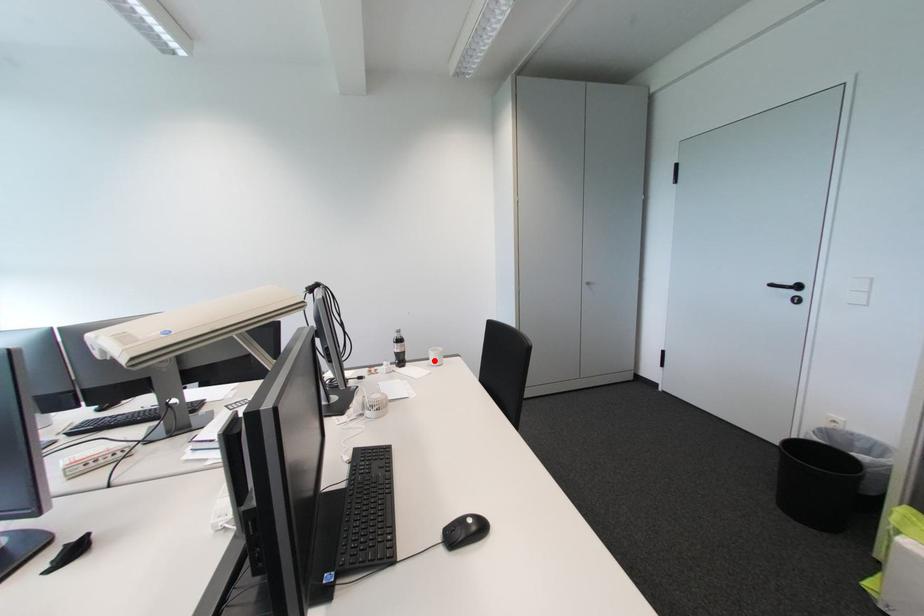
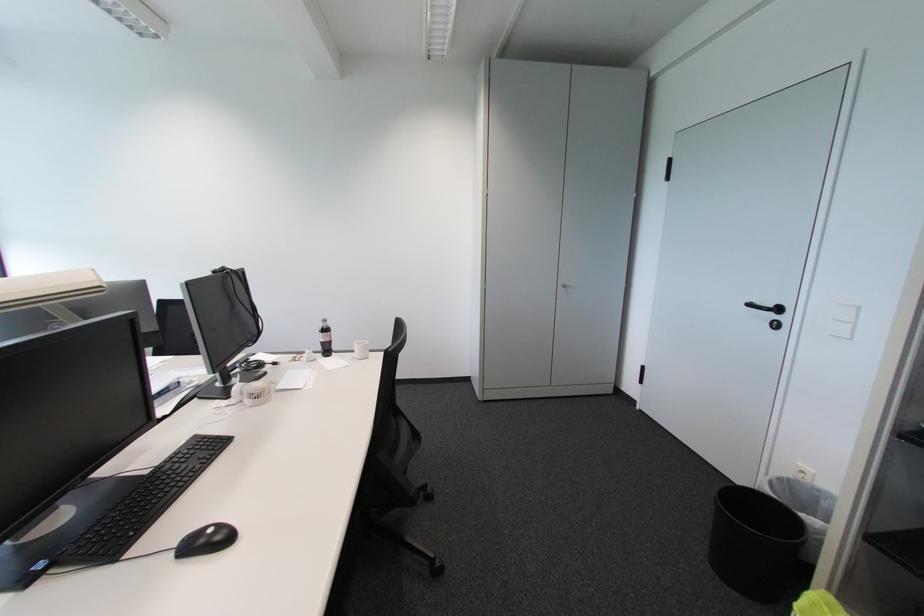
The point at the highlighted location is marked in the first image. Where is the corresponding point in the second image?

(359, 353)